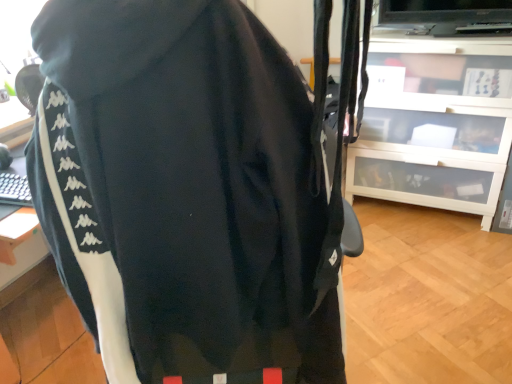
Question: Should I look upward or downward to see black fabric wetsuit at center?

Choices:
 (A) down
 (B) up

Answer: (A)